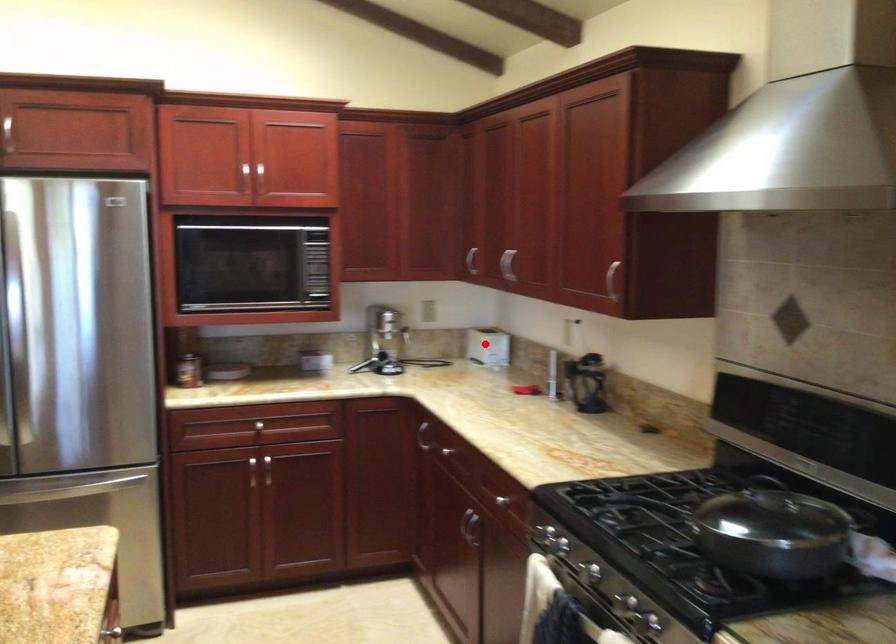
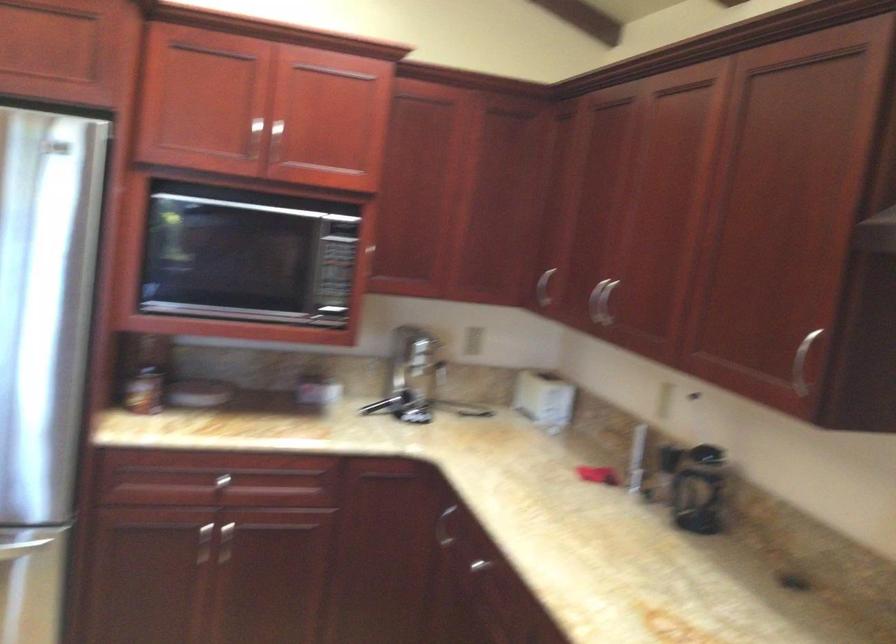
In the second image, find the point that corresponds to the highlighted location in the first image.

(544, 398)